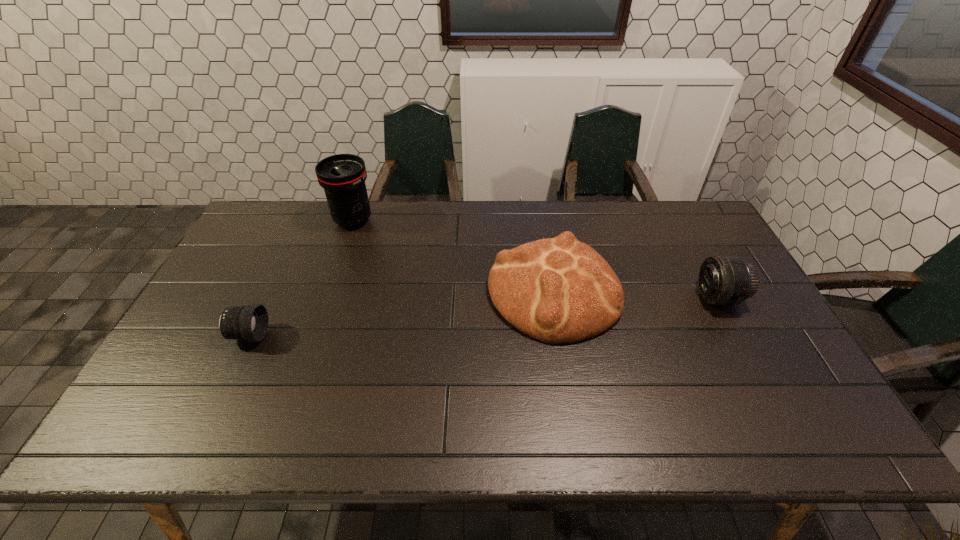
Find the location of a particular element. the farthest telephoto lens is located at coordinates (343, 176).

The image size is (960, 540). Identify the location of the tallest telephoto lens. coord(343,176).

You are a GUI agent. You are given a task and a screenshot of the screen. Output one action in this format:
    pyautogui.click(x=<x>, y=<y>)
    Task: Click on the second object from right to left
    The width and height of the screenshot is (960, 540).
    Given the screenshot: What is the action you would take?
    pyautogui.click(x=559, y=290)

Where is `the second tallest telephoto lens`? This screenshot has height=540, width=960. the second tallest telephoto lens is located at coordinates (723, 280).

Image resolution: width=960 pixels, height=540 pixels. What are the coordinates of `the second farthest telephoto lens` in the screenshot? It's located at (723, 280).

At what (x,y) coordinates should I click in order to perform the action: click on the shortest telephoto lens. Please return your answer as a coordinate pair (x, y). Image resolution: width=960 pixels, height=540 pixels. Looking at the image, I should click on (250, 323).

I want to click on the shortest object, so (250, 323).

I want to click on free space located on the right of the third object from right to left, so click(412, 221).

You are a GUI agent. You are given a task and a screenshot of the screen. Output one action in this format:
    pyautogui.click(x=<x>, y=<y>)
    Task: Click on the vacant space located on the right of the bread
    
    Given the screenshot: What is the action you would take?
    pyautogui.click(x=655, y=292)

Identify the location of vacant space situated 0.240m on the front-facing side of the rightmost object. The height and width of the screenshot is (540, 960). (614, 298).